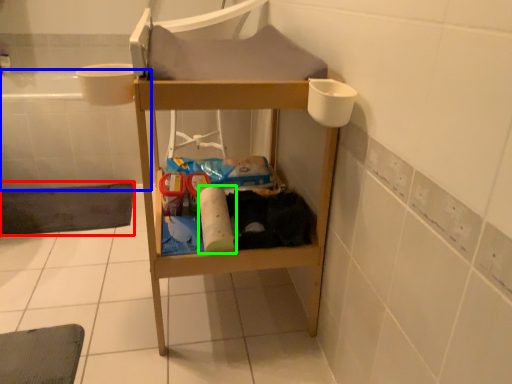
Question: Based on their relative distances, which object is farther from bath mat (highlighted by a red box)? Choose from bath (highlighted by a blue box) and toilet paper (highlighted by a green box).

Choices:
 (A) bath
 (B) toilet paper

Answer: (B)